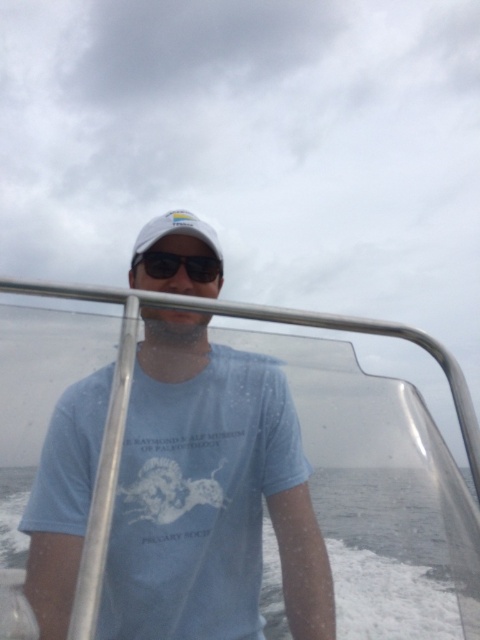
Looking at this image, is matte white cap at center above white matte baseball cap at center?

No.

Who is more forward, (x=169, y=493) or (x=180, y=230)?

Positioned in front is point (x=169, y=493).

Locate an element on the screen. The width and height of the screenshot is (480, 640). matte white cap at center is located at coordinates (208, 496).

Measure the distance between point (432,632) and camera.

Point (432,632) is 6.72 meters from camera.

The width and height of the screenshot is (480, 640). Describe the element at coordinates (387, 554) in the screenshot. I see `white foam at lower center` at that location.

Between point (445, 614) and point (155, 234), which one is positioned in front?

Point (155, 234) is in front.

This screenshot has height=640, width=480. I want to click on white foam at lower center, so click(387, 554).

Does white foam at lower center have a greater height compared to black plastic goggles at center?

Correct, white foam at lower center is much taller as black plastic goggles at center.

At what (x,y) coordinates should I click in order to perform the action: click on white foam at lower center. Please return your answer as a coordinate pair (x, y). Looking at the image, I should click on (387, 554).